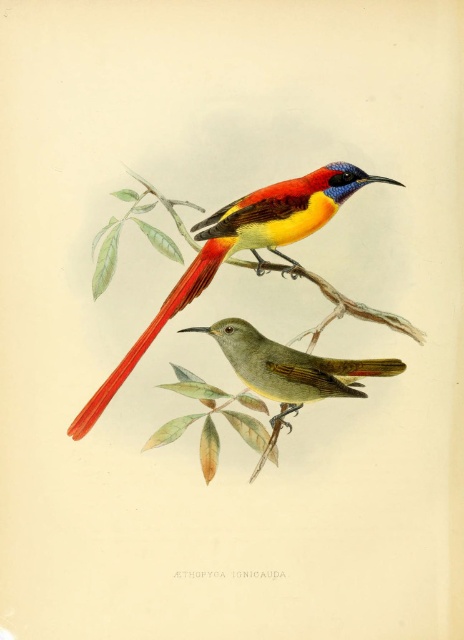
Question: Is the position of shiny red bird at upper center more distant than that of yellow-green glossy bird at center?

Choices:
 (A) no
 (B) yes

Answer: (A)

Question: In this image, where is shiny red bird at upper center located relative to yellow-green glossy bird at center?

Choices:
 (A) below
 (B) above

Answer: (B)

Question: Can you confirm if shiny red bird at upper center is positioned to the left of yellow-green glossy bird at center?

Choices:
 (A) yes
 (B) no

Answer: (A)

Question: Which object appears closest to the camera in this image?

Choices:
 (A) shiny red bird at upper center
 (B) yellow-green glossy bird at center

Answer: (A)